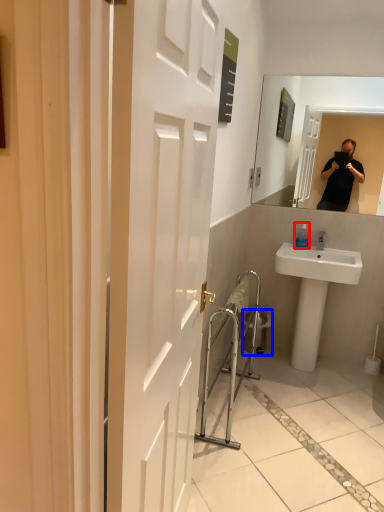
Question: Among these objects, which one is nearest to the camera, bottle (highlighted by a red box) or trash bin/can (highlighted by a blue box)?

Choices:
 (A) bottle
 (B) trash bin/can

Answer: (A)